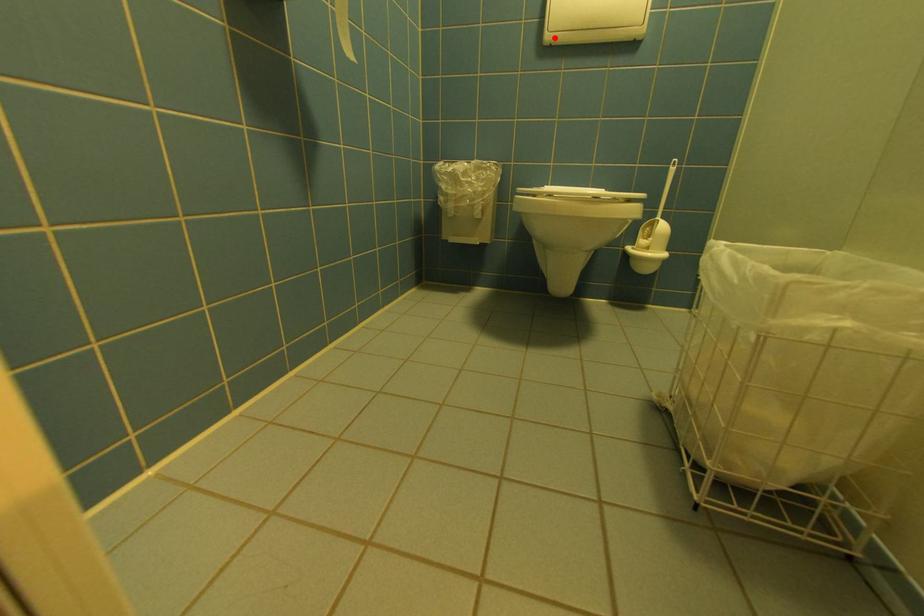
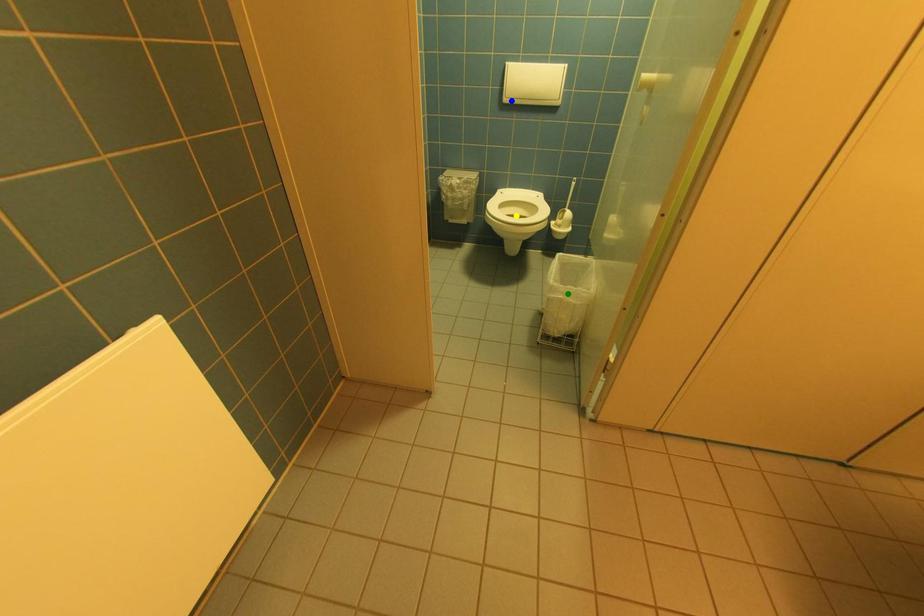
Question: I am providing you with two images of the same scene from different viewpoints. A red point is marked on the first image. You are given multiple points on the second image. Can you choose the point in image 2 that corresponds to the point in image 1?

Choices:
 (A) yellow point
 (B) green point
 (C) blue point

Answer: (C)